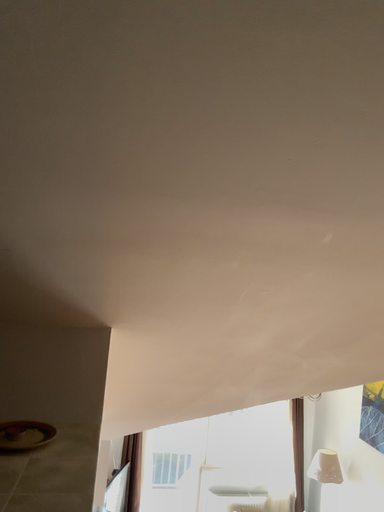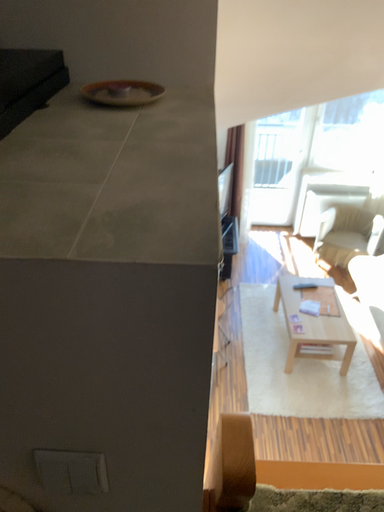
Question: Which way did the camera rotate in the video?

Choices:
 (A) rotated right
 (B) rotated left

Answer: (B)